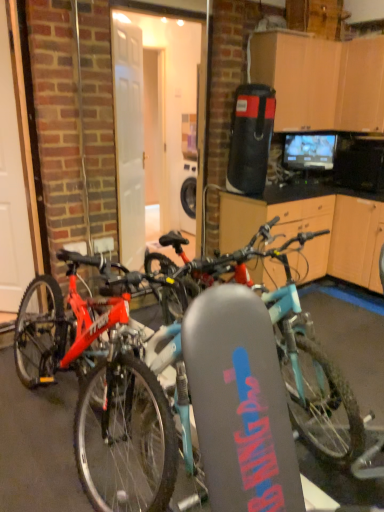
Question: Based on their positions, is matte red bicycle at center located to the left or right of white glossy door at left?

Choices:
 (A) right
 (B) left

Answer: (A)

Question: Is matte red bicycle at center bigger or smaller than white glossy door at left?

Choices:
 (A) small
 (B) big

Answer: (B)

Question: Is point (238, 478) positioned closer to the camera than point (6, 130)?

Choices:
 (A) closer
 (B) farther

Answer: (A)

Question: Is point (3, 203) positioned closer to the camera than point (180, 335)?

Choices:
 (A) closer
 (B) farther

Answer: (B)

Question: Would you say white glossy door at left is to the left or to the right of matte red bicycle at center in the picture?

Choices:
 (A) right
 (B) left

Answer: (B)

Question: In terms of width, does white glossy door at left look wider or thinner when compared to matte red bicycle at center?

Choices:
 (A) wide
 (B) thin

Answer: (B)

Question: From the image's perspective, is white glossy door at left located above or below matte red bicycle at center?

Choices:
 (A) below
 (B) above

Answer: (B)